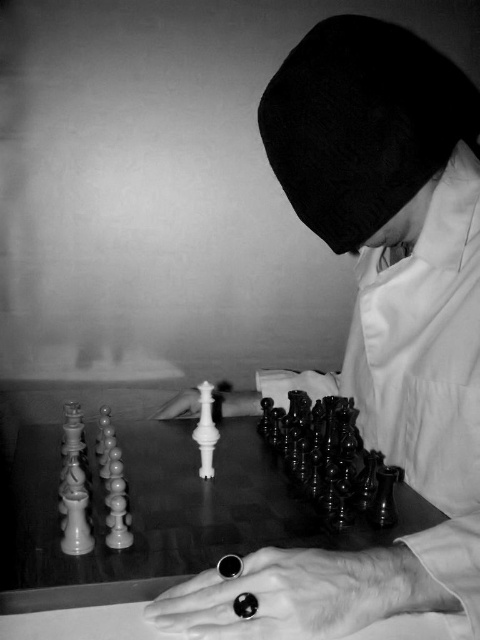
Question: Which of the following is the farthest from the observer?

Choices:
 (A) wooden chessboard at center
 (B) white glossy chess piece at center
 (C) smooth black chess pieces at center

Answer: (B)

Question: Is wooden chessboard at center further to the viewer compared to white glossy chess piece at center?

Choices:
 (A) yes
 (B) no

Answer: (B)

Question: Does wooden chessboard at center appear under white glossy chess piece at center?

Choices:
 (A) no
 (B) yes

Answer: (B)

Question: Is smooth black chess pieces at center to the left of white glossy chess piece at center from the viewer's perspective?

Choices:
 (A) no
 (B) yes

Answer: (A)

Question: Which of the following is the closest to the observer?

Choices:
 (A) (34, 486)
 (B) (399, 84)
 (C) (359, 618)
 (D) (189, 403)

Answer: (C)

Question: Based on their relative distances, which object is nearer to the wooden chessboard at center?

Choices:
 (A) smooth black chess pieces at center
 (B) black polished ring at lower center
 (C) white glossy chess piece at center

Answer: (A)